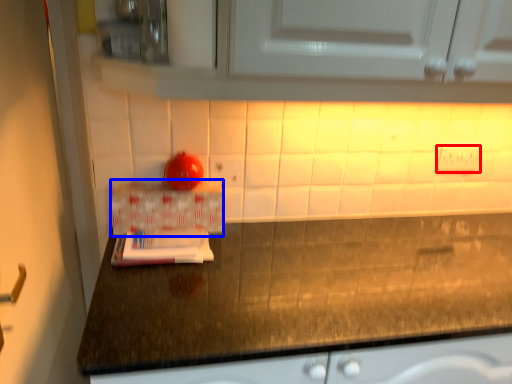
Question: Which of the following is the farthest to the observer, electric outlet (highlighted by a red box) or box (highlighted by a blue box)?

Choices:
 (A) electric outlet
 (B) box

Answer: (A)